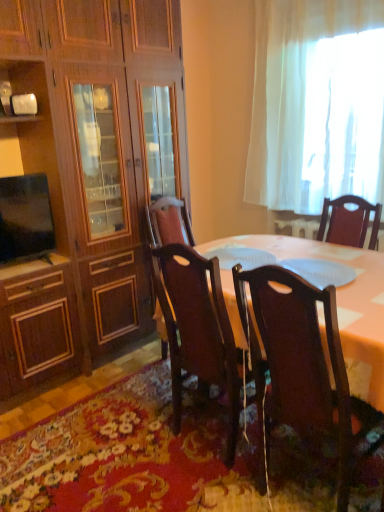
Question: From a real-world perspective, does white sheer curtain at upper right stand above floral carpet at lower center?

Choices:
 (A) no
 (B) yes

Answer: (B)

Question: Is white sheer curtain at upper right thinner than floral carpet at lower center?

Choices:
 (A) no
 (B) yes

Answer: (B)

Question: Is white sheer curtain at upper right behind floral carpet at lower center?

Choices:
 (A) yes
 (B) no

Answer: (A)

Question: Considering the relative positions of white sheer curtain at upper right and floral carpet at lower center in the image provided, is white sheer curtain at upper right to the right of floral carpet at lower center from the viewer's perspective?

Choices:
 (A) yes
 (B) no

Answer: (A)

Question: Does white sheer curtain at upper right have a greater width compared to floral carpet at lower center?

Choices:
 (A) yes
 (B) no

Answer: (B)

Question: Does white sheer curtain at upper right have a lesser height compared to floral carpet at lower center?

Choices:
 (A) no
 (B) yes

Answer: (A)

Question: Is wooden cabinet at left shorter than matte black tv at left?

Choices:
 (A) no
 (B) yes

Answer: (A)

Question: Is wooden cabinet at left located outside matte black tv at left?

Choices:
 (A) no
 (B) yes

Answer: (B)

Question: Considering the relative sizes of wooden cabinet at left and matte black tv at left in the image provided, is wooden cabinet at left bigger than matte black tv at left?

Choices:
 (A) yes
 (B) no

Answer: (A)

Question: Is wooden cabinet at left next to matte black tv at left and touching it?

Choices:
 (A) no
 (B) yes

Answer: (A)

Question: Is wooden cabinet at left oriented towards matte black tv at left?

Choices:
 (A) no
 (B) yes

Answer: (B)

Question: Can you confirm if wooden cabinet at left is thinner than matte black tv at left?

Choices:
 (A) no
 (B) yes

Answer: (A)

Question: Does floral carpet at lower center come in front of polished dark wood chair at center, the 2th chair in the right-to-left sequence?

Choices:
 (A) no
 (B) yes

Answer: (B)